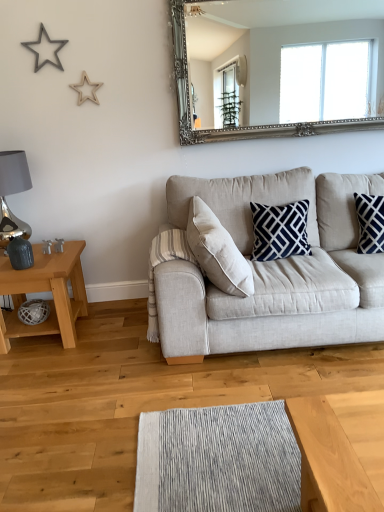
Locate an element on the screen. This screenshot has height=512, width=384. vacant space to the right of matte wooden table at left is located at coordinates (114, 331).